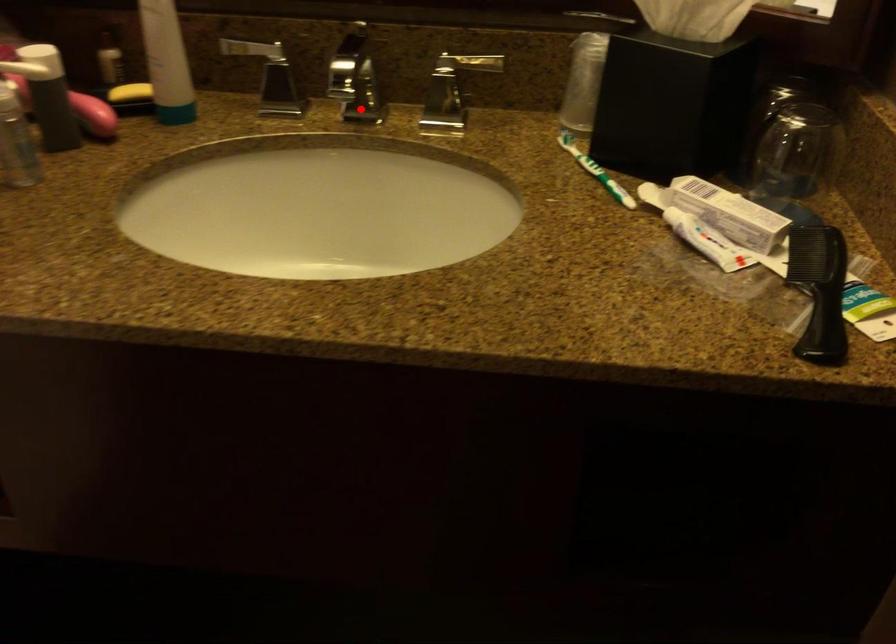
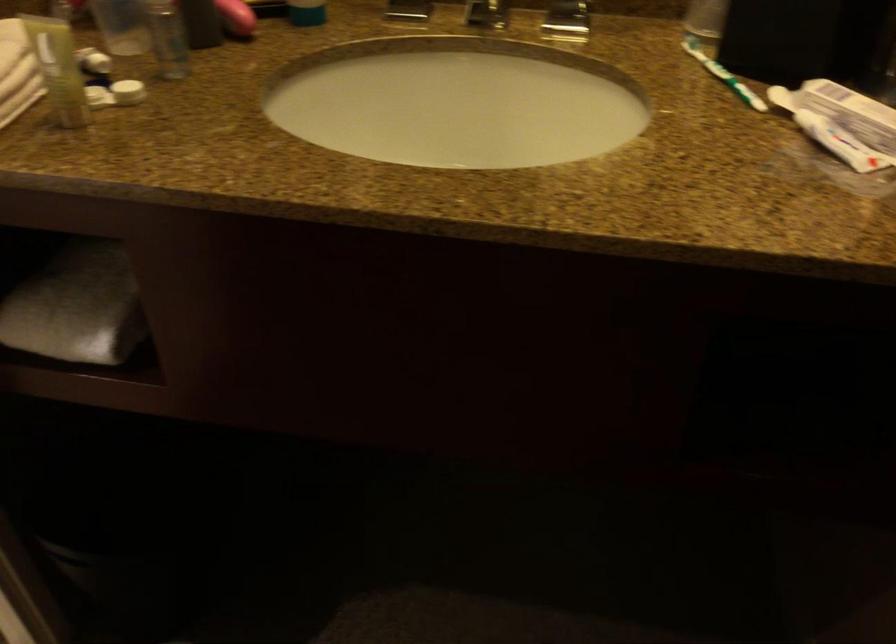
Question: I am providing you with two images of the same scene from different viewpoints. A red point is marked on the first image. Is the red point's position out of view in image 2?

Choices:
 (A) Yes
 (B) No

Answer: (B)